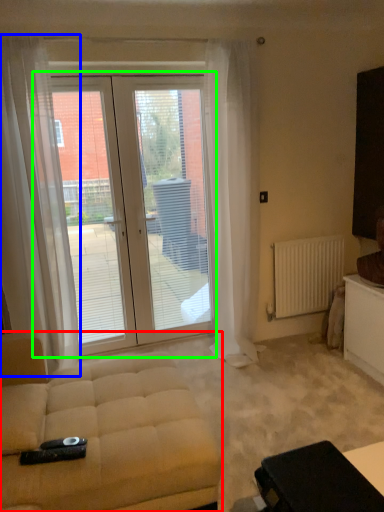
Question: Considering the real-world distances, which object is closest to studio couch (highlighted by a red box)? curtain (highlighted by a blue box) or door (highlighted by a green box).

Choices:
 (A) curtain
 (B) door

Answer: (A)